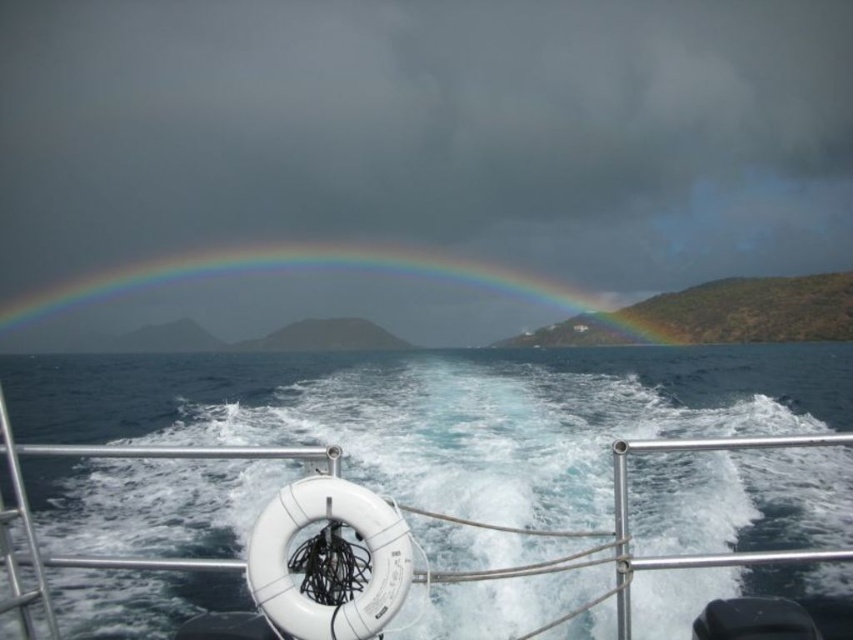
Who is taller, blue water at center or rainbow at center?

With more height is rainbow at center.

How much distance is there between blue water at center and rainbow at center?

blue water at center is 485.04 feet away from rainbow at center.

Identify the location of blue water at center. (444, 412).